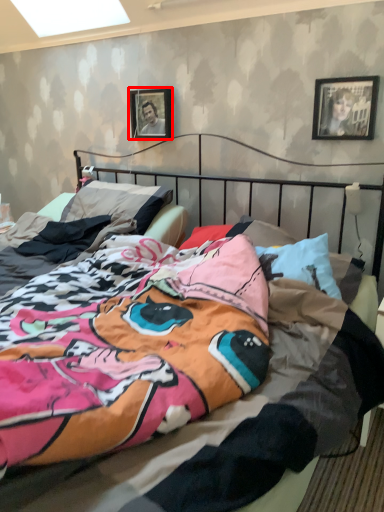
Question: Observing the image, what is the correct spatial positioning of picture frame (annotated by the red box) in reference to picture frame?

Choices:
 (A) right
 (B) left

Answer: (B)